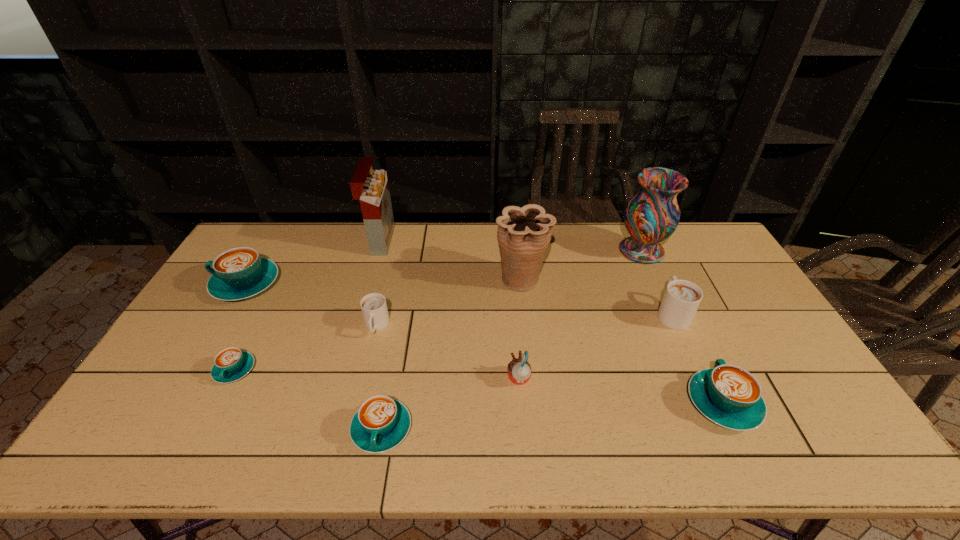
Find the location of a particular element. The height and width of the screenshot is (540, 960). free location located 0.320m on the front-facing side of the pink muffin is located at coordinates (386, 379).

I want to click on vacant space located 0.290m on the side with the handle of the left white cappuccino, so click(350, 434).

I want to click on vacant space situated with the handle on the right side of the rightmost turquoise cappuccino, so click(700, 353).

At what (x,y) coordinates should I click in order to perform the action: click on vacant point located with the handle on the right side of the rightmost turquoise cappuccino. Please return your answer as a coordinate pair (x, y). Looking at the image, I should click on (676, 303).

The width and height of the screenshot is (960, 540). What are the coordinates of `vacant space located with the handle on the right side of the rightmost turquoise cappuccino` in the screenshot? It's located at (693, 340).

This screenshot has height=540, width=960. Identify the location of free space located 0.140m with the handle on the right side of the shortest cappuccino. (201, 436).

You are a GUI agent. You are given a task and a screenshot of the screen. Output one action in this format:
    pyautogui.click(x=<x>, y=<y>)
    Task: Click on the cigarette case at the far edge
    Image resolution: width=960 pixels, height=540 pixels.
    Given the screenshot: What is the action you would take?
    pyautogui.click(x=370, y=187)

Identify the location of vase that is positioned at the far edge. (652, 215).

What are the coordinates of `free space at the far edge of the desktop` in the screenshot? It's located at (591, 261).

What are the coordinates of `free space at the near edge` in the screenshot? It's located at (427, 430).